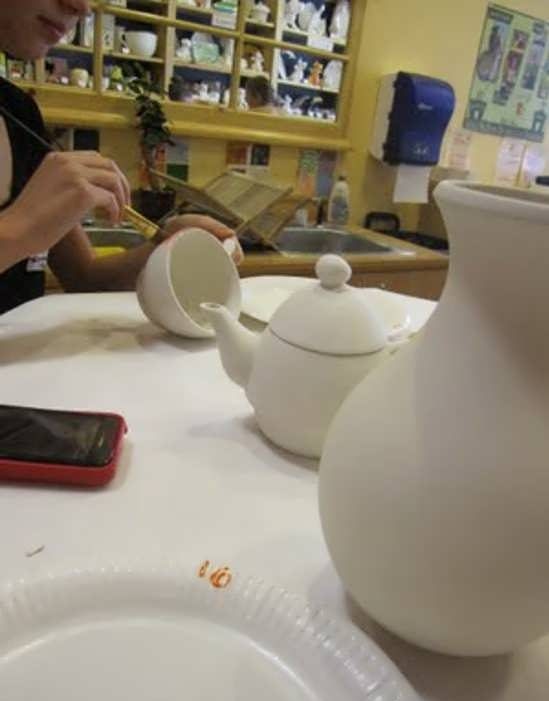
The image size is (549, 701). What are the coordinates of `pottery lid` in the screenshot? It's located at (344, 324).